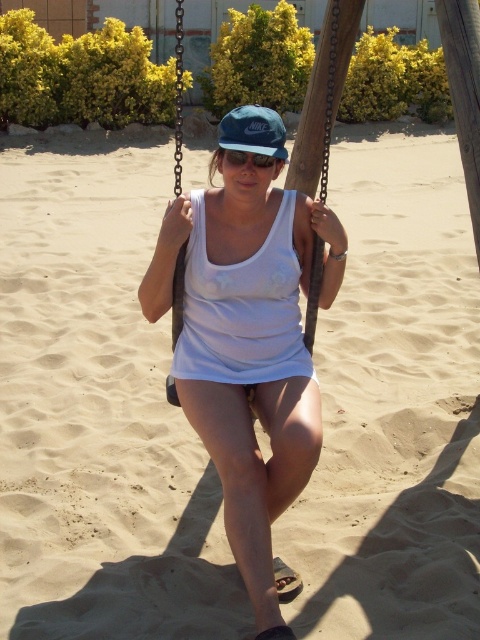
From the picture: Which is above, white matte tank top at center or metallic chain swing at center?

metallic chain swing at center is above.

Is white matte tank top at center positioned in front of metallic chain swing at center?

Yes, it is in front of metallic chain swing at center.

This screenshot has height=640, width=480. Identify the location of white matte tank top at center. (249, 348).

Which is behind, point (312, 397) or point (219, 156)?

The point (312, 397) is more distant.

Where is `white matte tank top at center`? white matte tank top at center is located at coordinates (249, 348).

In the scene shown: Is metallic chain swing at center positioned before green matte cap at center?

No, metallic chain swing at center is further to the viewer.

Based on the photo, which is above, metallic chain swing at center or green matte cap at center?

metallic chain swing at center is higher up.

Is point (177, 401) in front of point (267, 125)?

No.

Where is `metallic chain swing at center`? The image size is (480, 640). metallic chain swing at center is located at coordinates (328, 99).